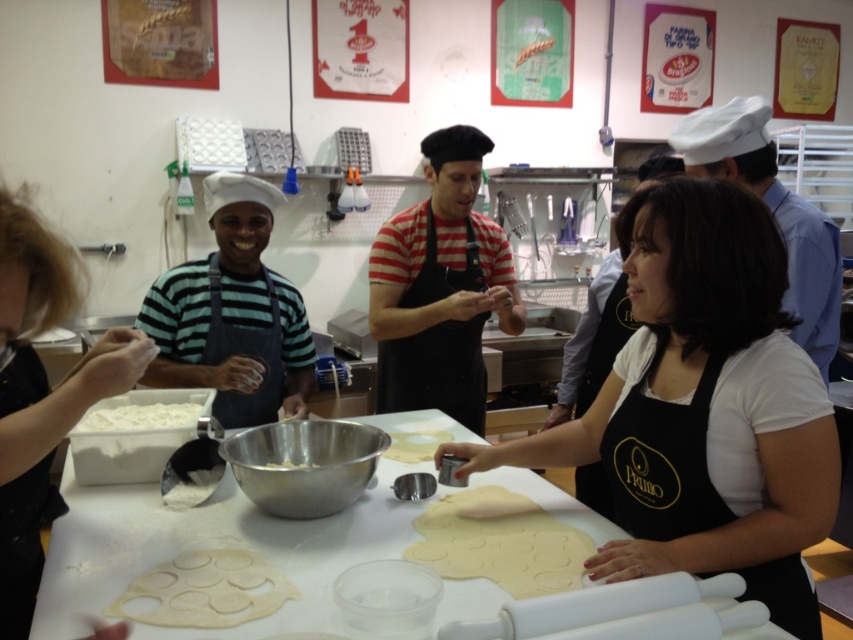
Based on the photo, you are standing in the baking workshop and want to reach the point at coordinates point (437, 436). There is an obstacle at point (128, 417). Will you encounter this obstacle before reaching your destination?

Yes, you will encounter the obstacle at point (128, 417) before reaching point (437, 436) because point (128, 417) is in front of point (437, 436).